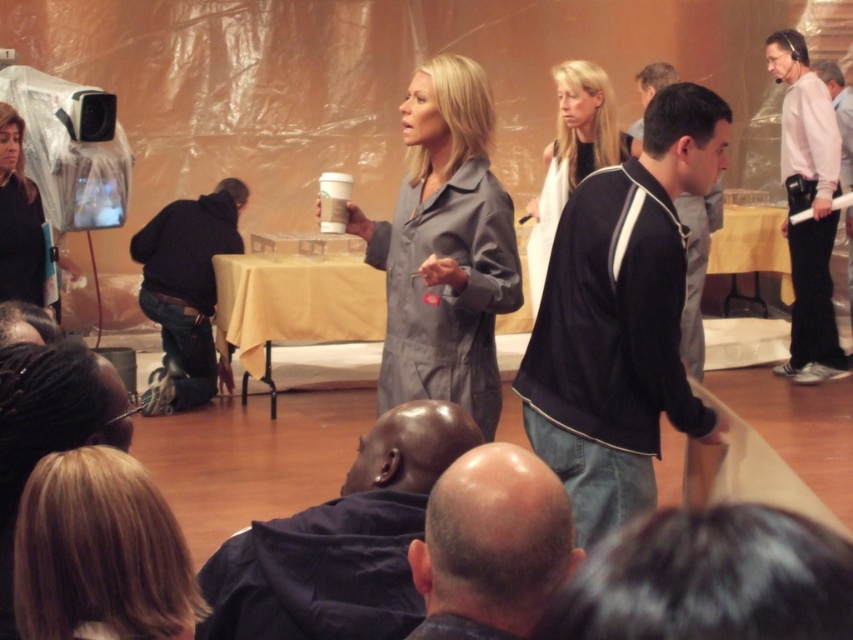
Question: From the image, what is the correct spatial relationship of white cotton shirt at right in relation to black denim jeans at lower left?

Choices:
 (A) below
 (B) above

Answer: (B)

Question: Where is white cotton shirt at right located in relation to matte black jacket at left in the image?

Choices:
 (A) below
 (B) above

Answer: (B)

Question: Which point is farther to the camera?

Choices:
 (A) dark blue jacket at center
 (B) bald head at center
 (C) black jersey at center
 (D) black fabric jacket at center-right

Answer: (C)

Question: Is the position of blonde hair at lower left less distant than that of black jersey at center?

Choices:
 (A) no
 (B) yes

Answer: (B)

Question: Which of the following is the closest to the observer?

Choices:
 (A) dark blue jacket at center
 (B) black denim jeans at lower left

Answer: (A)

Question: Which point is farther to the camera?

Choices:
 (A) white cotton shirt at right
 (B) matte black jacket at left

Answer: (A)